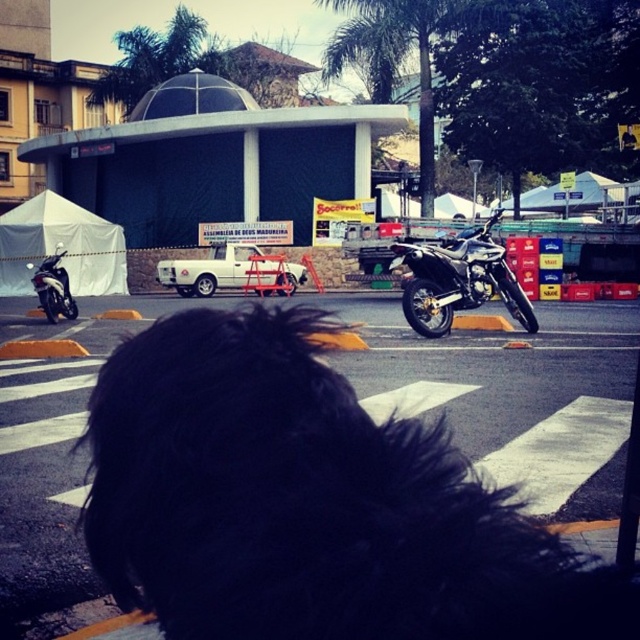
You are a delivery driver who needs to park your motorcycle. You see the black fluffy hair at center and the shiny black motorcycle at left. Which object is closer to you as you approach the scene?

The black fluffy hair at center is closer to the viewer than the shiny black motorcycle at left, so the black fluffy hair at center would be closer to you as you approach the scene.